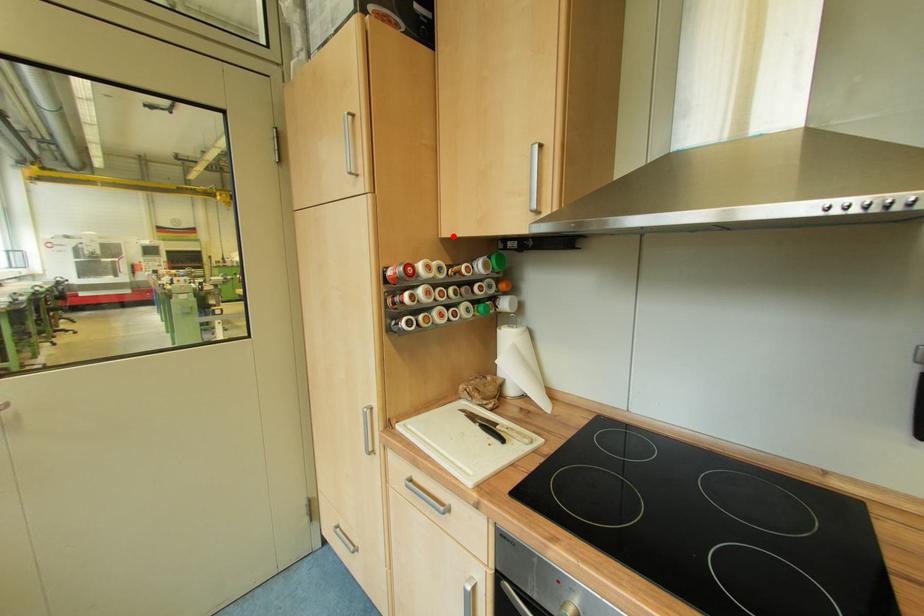
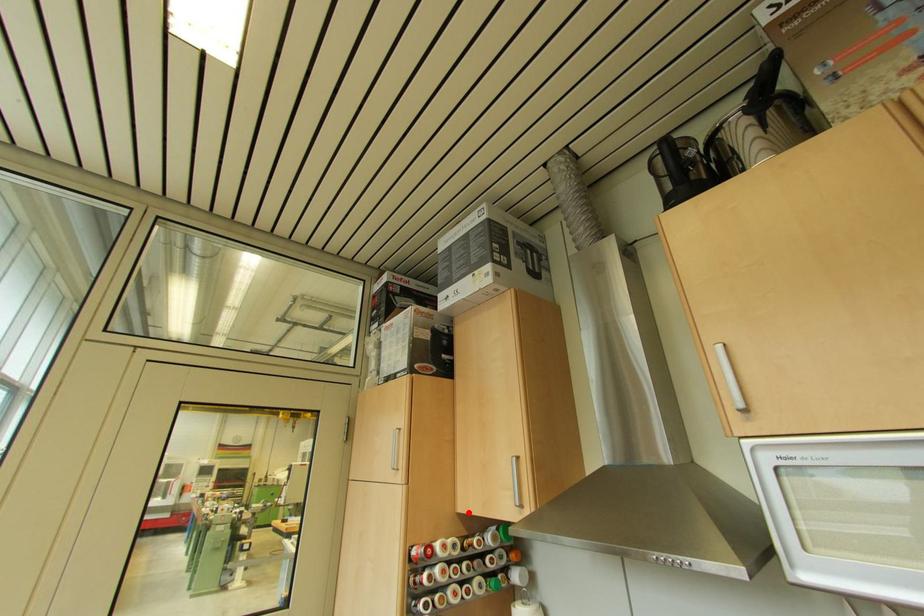
I am providing you with two images of the same scene from different viewpoints. A red point is marked on the first image and another point is marked on the second image. Is the marked point in image1 the same physical position as the marked point in image2?

Yes